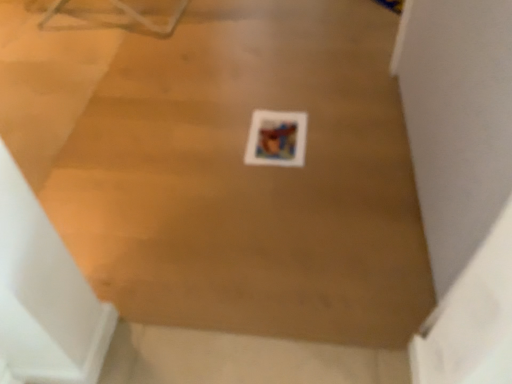
Where is `free space to the back side of matte paper print at center`? The width and height of the screenshot is (512, 384). free space to the back side of matte paper print at center is located at coordinates (273, 94).